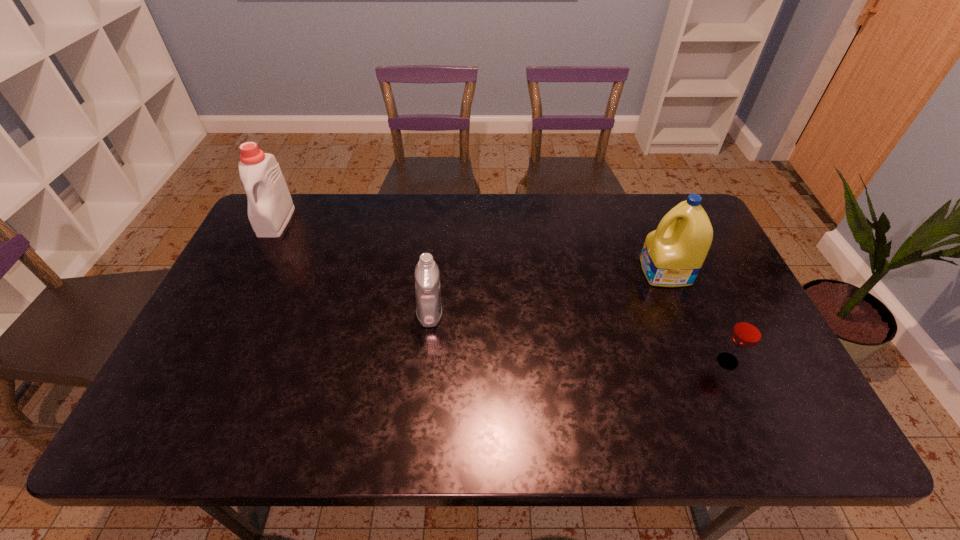
Locate an element on the screen. This screenshot has height=540, width=960. vacant space that satisfies the following two spatial constraints: 1. on the handle side of the farthest detergent; 2. on the left side of the nearest object is located at coordinates (204, 361).

Identify the location of vacant space that satisfies the following two spatial constraints: 1. on the handle side of the leftmost detergent; 2. on the left side of the third object from right to left. The height and width of the screenshot is (540, 960). (228, 314).

Identify the location of vacant space that satisfies the following two spatial constraints: 1. on the label of the third nearest object; 2. on the back side of the nearest object. (702, 361).

Where is `free space that satisfies the following two spatial constraints: 1. on the handle side of the nearest detergent; 2. on the left side of the leftmost object`? The width and height of the screenshot is (960, 540). free space that satisfies the following two spatial constraints: 1. on the handle side of the nearest detergent; 2. on the left side of the leftmost object is located at coordinates (228, 314).

This screenshot has height=540, width=960. What are the coordinates of `free spot that satisfies the following two spatial constraints: 1. on the handle side of the nearest object; 2. on the right side of the leftmost detergent` in the screenshot? It's located at (204, 361).